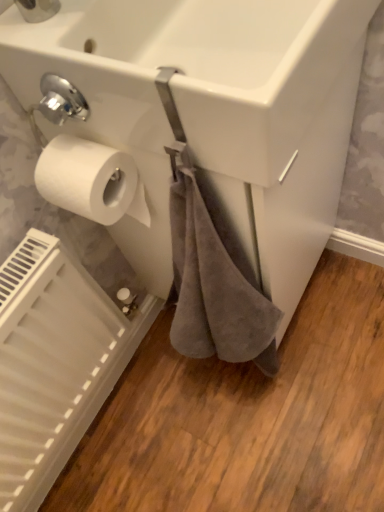
What do you see at coordinates (192, 71) in the screenshot? The width and height of the screenshot is (384, 512). I see `white glossy sink at upper center` at bounding box center [192, 71].

The height and width of the screenshot is (512, 384). What do you see at coordinates (49, 362) in the screenshot?
I see `white matte radiator at lower left` at bounding box center [49, 362].

What is the approximate height of white matte radiator at lower left?

white matte radiator at lower left is 17.68 inches tall.

Where is `white glossy sink at upper center`? This screenshot has height=512, width=384. white glossy sink at upper center is located at coordinates (192, 71).

Which is more to the left, white matte radiator at lower left or white matte toilet paper at left?

From the viewer's perspective, white matte radiator at lower left appears more on the left side.

How far apart are white matte radiator at lower left and white matte toilet paper at left?

They are 12.63 inches apart.

Relative to white matte toilet paper at left, is white matte radiator at lower left in front or behind?

white matte radiator at lower left is positioned farther from the viewer than white matte toilet paper at left.

Is white matte radiator at lower left situated inside white matte toilet paper at left or outside?

white matte radiator at lower left lies outside white matte toilet paper at left.

From the image's perspective, is white matte toilet paper at left below white matte radiator at lower left?

No, from the image's perspective, white matte toilet paper at left is not beneath white matte radiator at lower left.

Locate an element on the screen. radiator behind the white matte toilet paper at left is located at coordinates (49, 362).

Between white matte toilet paper at left and white matte radiator at lower left, which one has more height?

white matte radiator at lower left is taller.

Between white matte toilet paper at left and white glossy sink at upper center, which one has smaller size?

white matte toilet paper at left.

From a real-world perspective, is white matte toilet paper at left physically located above or below white glossy sink at upper center?

white matte toilet paper at left is below white glossy sink at upper center.

Does white matte toilet paper at left have a greater width compared to white glossy sink at upper center?

No.

In the scene shown: Considering the sizes of objects white matte toilet paper at left and white glossy sink at upper center in the image provided, who is taller, white matte toilet paper at left or white glossy sink at upper center?

Standing taller between the two is white glossy sink at upper center.

Does point (131, 22) lie behind point (26, 462)?

No, (131, 22) is closer to viewer.

Is white glossy sink at upper center next to white matte radiator at lower left and touching it?

No, white glossy sink at upper center is not touching white matte radiator at lower left.

Is white glossy sink at upper center inside or outside of white matte radiator at lower left?

white glossy sink at upper center lies outside white matte radiator at lower left.

Consider the image. Is white glossy sink at upper center to the left of white matte radiator at lower left from the viewer's perspective?

Incorrect, white glossy sink at upper center is not on the left side of white matte radiator at lower left.

Can you confirm if white matte radiator at lower left is smaller than white glossy sink at upper center?

Yes, white matte radiator at lower left is smaller than white glossy sink at upper center.

Between point (35, 306) and point (173, 13), which one is positioned in front?

The point (173, 13) is more forward.

From the picture: Are white matte radiator at lower left and white glossy sink at upper center beside each other?

white matte radiator at lower left is not next to white glossy sink at upper center, and they're not touching.

Is white matte radiator at lower left positioned with its back to white glossy sink at upper center?

That's not correct — white matte radiator at lower left is not looking away from white glossy sink at upper center.

Is white glossy sink at upper center situated inside white matte toilet paper at left or outside?

white glossy sink at upper center exists outside the volume of white matte toilet paper at left.

Is white glossy sink at upper center oriented towards white matte toilet paper at left?

No, white glossy sink at upper center is not oriented towards white matte toilet paper at left.

Is white glossy sink at upper center placed right next to white matte toilet paper at left?

No, white glossy sink at upper center is not with white matte toilet paper at left.

Considering their positions, is white glossy sink at upper center located in front of or behind white matte toilet paper at left?

white glossy sink at upper center is positioned closer to the viewer than white matte toilet paper at left.

Locate an element on the screen. The width and height of the screenshot is (384, 512). radiator lying behind the white matte toilet paper at left is located at coordinates (49, 362).

The image size is (384, 512). What are the coordinates of `radiator on the left of white matte toilet paper at left` in the screenshot? It's located at (49, 362).

When comparing their distances from white matte toilet paper at left, does white glossy sink at upper center or white matte radiator at lower left seem further?

white matte radiator at lower left is positioned further to the anchor white matte toilet paper at left.

Estimate the real-world distances between objects in this image. Which object is further from white matte radiator at lower left, white matte toilet paper at left or white glossy sink at upper center?

Based on the image, white glossy sink at upper center appears to be further to white matte radiator at lower left.

From the image, which object appears to be nearer to white matte radiator at lower left, white glossy sink at upper center or white matte toilet paper at left?

The object closer to white matte radiator at lower left is white matte toilet paper at left.

Considering their positions, is white matte radiator at lower left positioned further to white glossy sink at upper center than white matte toilet paper at left?

Based on the image, white matte radiator at lower left appears to be further to white glossy sink at upper center.

Looking at the image, which one is located closer to white matte toilet paper at left, white matte radiator at lower left or white glossy sink at upper center?

The object closer to white matte toilet paper at left is white glossy sink at upper center.

Estimate the real-world distances between objects in this image. Which object is closer to white glossy sink at upper center, white matte toilet paper at left or white matte radiator at lower left?

Based on the image, white matte toilet paper at left appears to be nearer to white glossy sink at upper center.

You are a GUI agent. You are given a task and a screenshot of the screen. Output one action in this format:
    pyautogui.click(x=<x>, y=<y>)
    Task: Click on the toilet paper between white glossy sink at upper center and white matte radiator at lower left from top to bottom
    This screenshot has width=384, height=512.
    Given the screenshot: What is the action you would take?
    pyautogui.click(x=91, y=180)